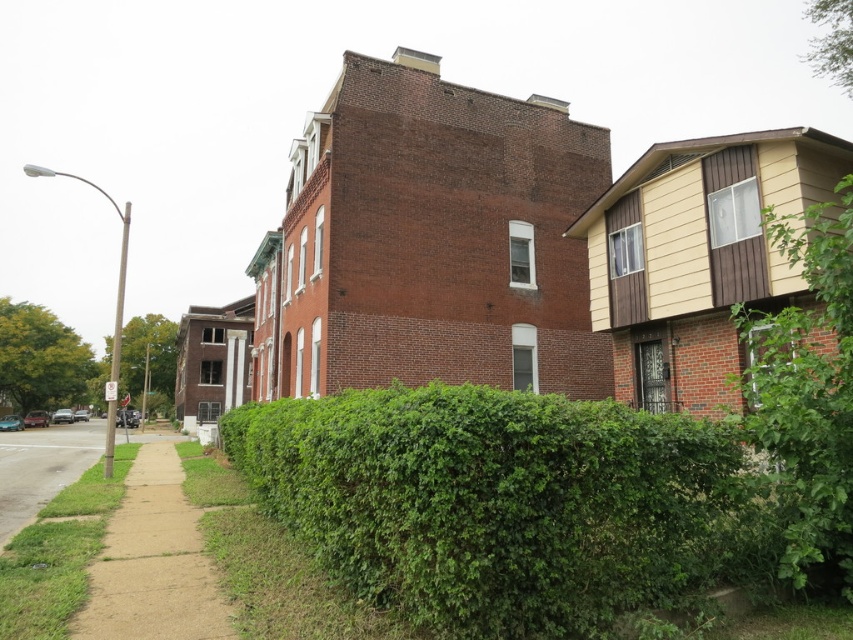
Does green leafy hedge at center appear over brown dirt sidewalk at lower left?

Yes.

Can you confirm if green leafy hedge at center is bigger than brown dirt sidewalk at lower left?

No, green leafy hedge at center is not bigger than brown dirt sidewalk at lower left.

Which is behind, point (675, 570) or point (119, 621)?

The point (119, 621) is behind.

I want to click on green leafy hedge at center, so click(x=508, y=502).

Can you confirm if green leafy hedge at center is positioned below green leafy bush at lower right?

Indeed, green leafy hedge at center is positioned under green leafy bush at lower right.

Is point (537, 470) closer to camera compared to point (844, 568)?

Yes, point (537, 470) is in front of point (844, 568).

Who is more forward, (692, 547) or (810, 484)?

Point (810, 484) is in front.

Image resolution: width=853 pixels, height=640 pixels. I want to click on green leafy hedge at center, so click(508, 502).

Who is shorter, green leafy bush at lower right or brown dirt sidewalk at lower left?

green leafy bush at lower right is shorter.

Which is in front, point (801, 518) or point (189, 518)?

Point (801, 518)

Find the location of a particular element. The height and width of the screenshot is (640, 853). green leafy bush at lower right is located at coordinates (807, 390).